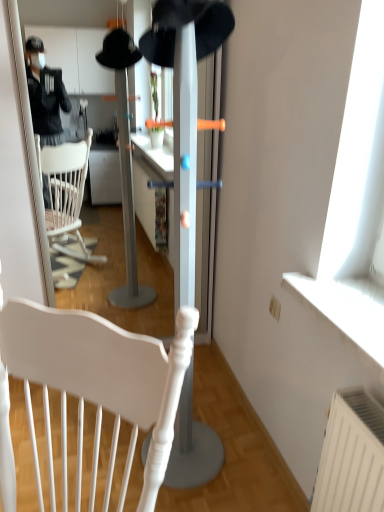
What do you see at coordinates (183, 25) in the screenshot?
I see `black felt hat at center` at bounding box center [183, 25].

Locate an element on the screen. This screenshot has height=512, width=384. black felt hat at center is located at coordinates [183, 25].

The image size is (384, 512). What are the coordinates of `white matte chair at center` in the screenshot? It's located at (99, 386).

What do you see at coordinates (99, 386) in the screenshot? The height and width of the screenshot is (512, 384). I see `white matte chair at center` at bounding box center [99, 386].

Locate an element on the screen. The height and width of the screenshot is (512, 384). black felt hat at center is located at coordinates (183, 25).

Considering the positions of objects white matte chair at center and black felt hat at center in the image provided, who is more to the left, white matte chair at center or black felt hat at center?

Positioned to the left is white matte chair at center.

Which object is closer to the camera, white matte chair at center or black felt hat at center?

black felt hat at center is in front.

Between point (44, 379) and point (163, 2), which one is positioned in front?

The point (44, 379) is closer to the camera.

From the image's perspective, is white matte chair at center located above black felt hat at center?

Incorrect, from the image's perspective, white matte chair at center is lower than black felt hat at center.

From a real-world perspective, is white matte chair at center physically above black felt hat at center?

No, from a real-world perspective, white matte chair at center is not above black felt hat at center.

Can you confirm if white matte chair at center is thinner than black felt hat at center?

No, white matte chair at center is not thinner than black felt hat at center.

Considering the sizes of white matte chair at center and black felt hat at center in the image, is white matte chair at center taller or shorter than black felt hat at center?

Clearly, white matte chair at center is shorter compared to black felt hat at center.

Considering the sizes of objects white matte chair at center and black felt hat at center in the image provided, who is bigger, white matte chair at center or black felt hat at center?

Bigger between the two is white matte chair at center.

Could black felt hat at center be considered to be inside white matte chair at center?

That's incorrect, black felt hat at center is not inside white matte chair at center.

Would you say white matte chair at center is a long distance from black felt hat at center?

No, white matte chair at center is in close proximity to black felt hat at center.

Could you tell me if white matte chair at center is turned towards black felt hat at center?

No, white matte chair at center is not facing towards black felt hat at center.

Can you tell me how much white matte chair at center and black felt hat at center differ in facing direction?

There is a 95.6-degree angle between the facing directions of white matte chair at center and black felt hat at center.

Where is `chair lying on the left of black felt hat at center`? This screenshot has width=384, height=512. chair lying on the left of black felt hat at center is located at coordinates (99, 386).

Which object is positioned more to the right, black felt hat at center or white matte chair at center?

From the viewer's perspective, black felt hat at center appears more on the right side.

Does black felt hat at center come in front of white matte chair at center?

Yes, the depth of black felt hat at center is less than that of white matte chair at center.

Does point (227, 25) come closer to viewer compared to point (152, 422)?

No.

From the image's perspective, does black felt hat at center appear lower than white matte chair at center?

No, from the image's perspective, black felt hat at center is not beneath white matte chair at center.

From a real-world perspective, which object rests below the other?

From a 3D spatial view, white matte chair at center is below.

Does black felt hat at center have a greater width compared to white matte chair at center?

No.

Between black felt hat at center and white matte chair at center, which one has less height?

With less height is white matte chair at center.

Considering the sizes of objects black felt hat at center and white matte chair at center in the image provided, who is smaller, black felt hat at center or white matte chair at center?

black felt hat at center is smaller.

Is black felt hat at center spatially inside white matte chair at center, or outside of it?

black felt hat at center lies outside white matte chair at center.

Is black felt hat at center next to white matte chair at center?

No, black felt hat at center is not making contact with white matte chair at center.

Does black felt hat at center turn towards white matte chair at center?

No, black felt hat at center is not facing towards white matte chair at center.

Find the location of `hat above the white matte chair at center (from a real-world perspective)`. hat above the white matte chair at center (from a real-world perspective) is located at coordinates (183, 25).

The height and width of the screenshot is (512, 384). Find the location of `hat to the right of white matte chair at center`. hat to the right of white matte chair at center is located at coordinates (183, 25).

The width and height of the screenshot is (384, 512). I want to click on chair below the black felt hat at center (from the image's perspective), so click(99, 386).